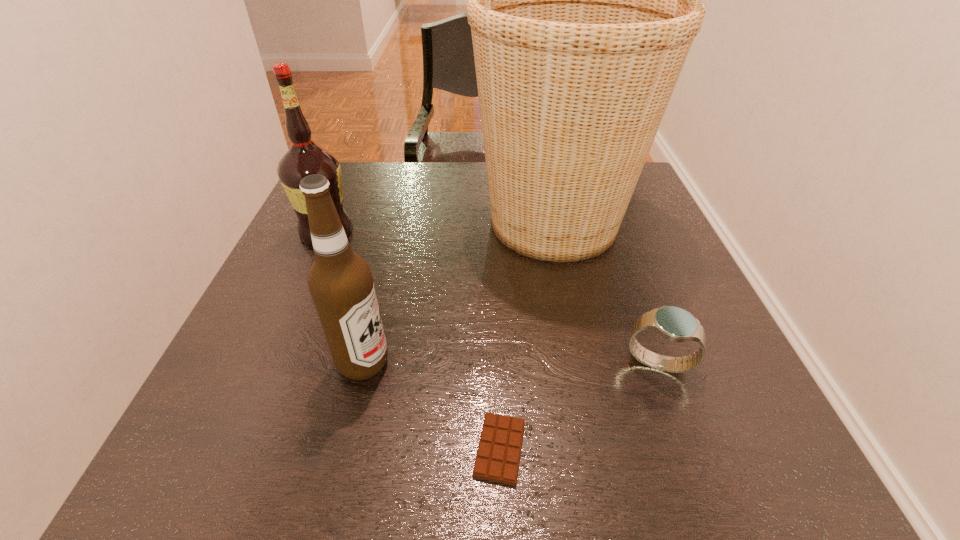
Identify the location of vacant space located 0.330m on the label of the fourth object from right to left. This screenshot has height=540, width=960. (574, 363).

Identify the location of free space located on the front of the fourth tallest object. The width and height of the screenshot is (960, 540). (694, 460).

Where is `vacant space located 0.200m on the left of the candy bar`? Image resolution: width=960 pixels, height=540 pixels. vacant space located 0.200m on the left of the candy bar is located at coordinates (341, 449).

Where is `object positioned at the far edge`? The image size is (960, 540). object positioned at the far edge is located at coordinates (583, 0).

The width and height of the screenshot is (960, 540). In order to click on object that is at the near edge in this screenshot , I will do `click(498, 454)`.

In order to click on object located at the left edge in this screenshot , I will do `click(305, 157)`.

Locate an element on the screen. This screenshot has height=540, width=960. basket that is positioned at the right edge is located at coordinates (583, 0).

Locate an element on the screen. This screenshot has height=540, width=960. watch positioned at the right edge is located at coordinates (673, 323).

Find the location of a particular element. object located at the far right corner is located at coordinates (583, 0).

In the image, there is a desktop. Find the location of `vacant space at the far edge`. vacant space at the far edge is located at coordinates (413, 187).